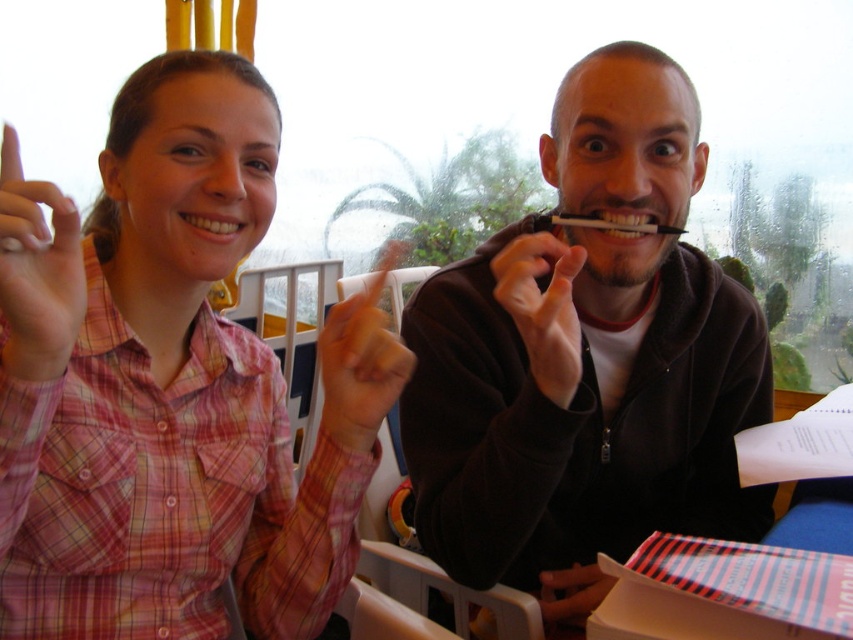
Who is lower down, black matte pen at center or black matte hand at center?

Positioned lower is black matte pen at center.

Where is `black matte pen at center`? The image size is (853, 640). black matte pen at center is located at coordinates (578, 401).

Which is behind, point (540, 150) or point (527, 310)?

The point (540, 150) is behind.

Where is `black matte pen at center`? The height and width of the screenshot is (640, 853). black matte pen at center is located at coordinates (578, 401).

Does white glossy teeth at upper center lie in front of white plastic toothpick at center?

Yes, it is.

Who is positioned more to the left, white glossy teeth at upper center or white plastic toothpick at center?

white glossy teeth at upper center

Is point (206, 230) closer to camera compared to point (662, 225)?

Yes, it is.

You are a GUI agent. You are given a task and a screenshot of the screen. Output one action in this format:
    pyautogui.click(x=<x>, y=<y>)
    Task: Click on the white glossy teeth at upper center
    Image resolution: width=853 pixels, height=640 pixels.
    Given the screenshot: What is the action you would take?
    pyautogui.click(x=213, y=225)

The image size is (853, 640). Find the location of `plaid shirt at center`. plaid shirt at center is located at coordinates (170, 387).

Looking at this image, can you confirm if plaid shirt at center is positioned to the right of black matte hand at center?

No, plaid shirt at center is not to the right of black matte hand at center.

Is point (184, 340) positioned after point (535, 364)?

That is True.

You are a GUI agent. You are given a task and a screenshot of the screen. Output one action in this format:
    pyautogui.click(x=<x>, y=<y>)
    Task: Click on the plaid shirt at center
    The width and height of the screenshot is (853, 640).
    Given the screenshot: What is the action you would take?
    pyautogui.click(x=170, y=387)